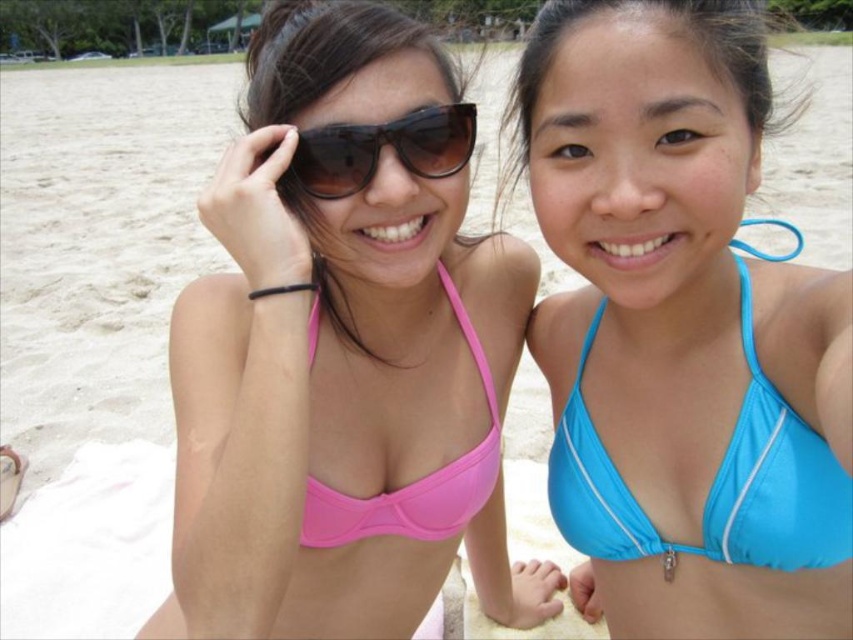
Question: Which point is farther to the camera?

Choices:
 (A) (622, 461)
 (B) (375, 502)
 (C) (323, 140)

Answer: (B)

Question: Which point is farther from the camera taking this photo?

Choices:
 (A) (334, 212)
 (B) (447, 300)

Answer: (B)

Question: Does pink matte bikini top at upper left have a larger size compared to blue matte bikini top at right?

Choices:
 (A) no
 (B) yes

Answer: (B)

Question: Does pink matte bikini top at upper left come in front of pink matte bikini top at center?

Choices:
 (A) yes
 (B) no

Answer: (A)

Question: Which point is closer to the camera?

Choices:
 (A) click(273, 93)
 (B) click(724, 378)
 (C) click(305, 136)

Answer: (C)

Question: Does blue matte bikini top at right have a larger size compared to pink matte bikini top at center?

Choices:
 (A) yes
 (B) no

Answer: (A)